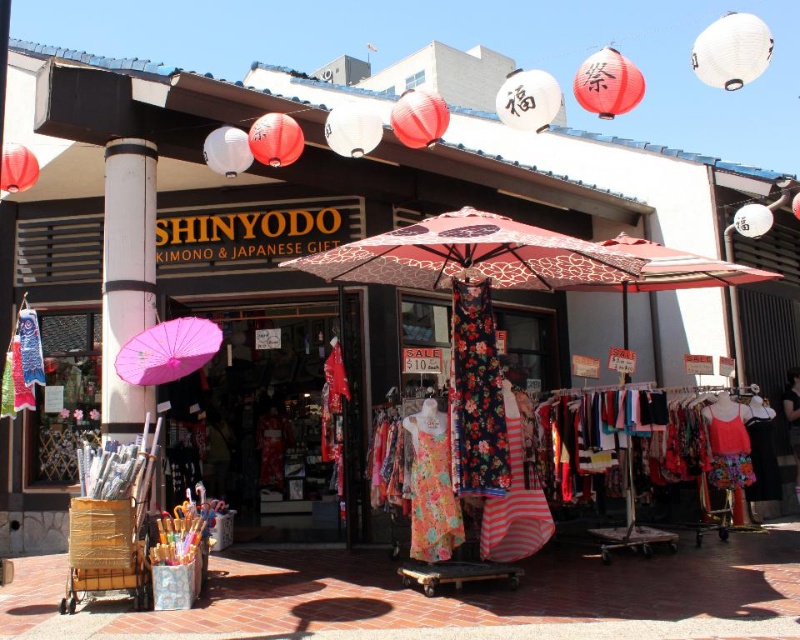
Question: Estimate the real-world distances between objects in this image. Which object is farther from the wooden cart at lower left?

Choices:
 (A) white matte pole at center
 (B) red printed fabric umbrella at center
 (C) floral-patterned fabric umbrella at center
 (D) pink paper umbrella at left

Answer: (B)

Question: Which object is positioned closest to the pink paper umbrella at left?

Choices:
 (A) red printed fabric umbrella at center
 (B) wooden cart at lower left

Answer: (B)

Question: Observing the image, what is the correct spatial positioning of floral-patterned fabric umbrella at center in reference to pink paper umbrella at left?

Choices:
 (A) below
 (B) above

Answer: (B)

Question: Does floral-patterned fabric umbrella at center have a greater width compared to wooden cart at lower left?

Choices:
 (A) no
 (B) yes

Answer: (B)

Question: Can you confirm if floral-patterned fabric umbrella at center is thinner than wooden cart at lower left?

Choices:
 (A) no
 (B) yes

Answer: (A)

Question: Among these objects, which one is farthest from the camera?

Choices:
 (A) wooden cart at lower left
 (B) red printed fabric umbrella at center
 (C) pink paper umbrella at left
 (D) floral-patterned fabric umbrella at center

Answer: (B)